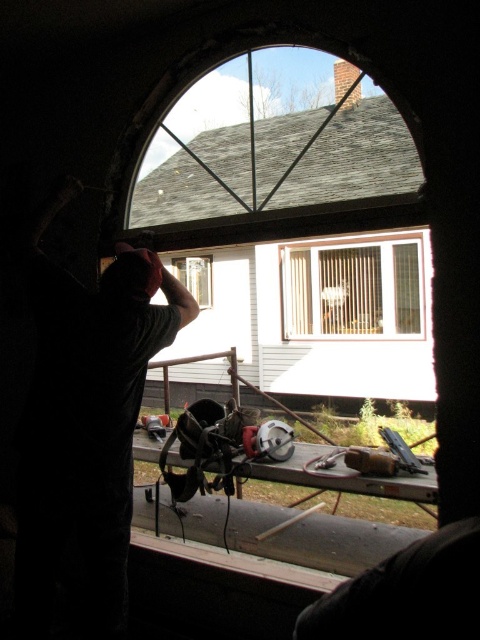
Question: Is dark gray t-shirt at left below white textured window at center?

Choices:
 (A) no
 (B) yes

Answer: (B)

Question: Which of the following is the closest to the observer?

Choices:
 (A) (203, 294)
 (B) (376, 269)

Answer: (B)

Question: Can you confirm if white textured window at center is thinner than clear glass window at center?

Choices:
 (A) yes
 (B) no

Answer: (B)

Question: Among these objects, which one is farthest from the camera?

Choices:
 (A) clear glass window at center
 (B) dark gray t-shirt at left

Answer: (A)

Question: Estimate the real-world distances between objects in this image. Which object is closer to the clear glass window at center?

Choices:
 (A) white textured window at center
 (B) dark gray t-shirt at left

Answer: (A)

Question: In this image, where is white textured window at center located relative to clear glass window at center?

Choices:
 (A) left
 (B) right

Answer: (B)